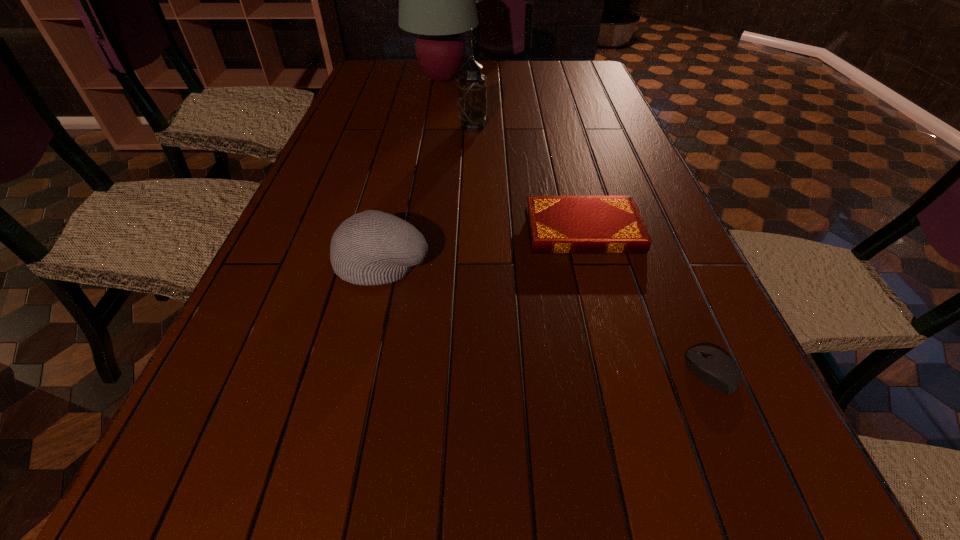
Identify the location of vacant space located 0.140m on the cover of the hardback book. (468, 230).

Locate an element on the screen. The width and height of the screenshot is (960, 540). vacant space situated 0.190m on the cover of the hardback book is located at coordinates (445, 230).

You are a GUI agent. You are given a task and a screenshot of the screen. Output one action in this format:
    pyautogui.click(x=<x>, y=<y>)
    Task: Click on the free spot located 0.150m on the cover of the hardback book
    
    Given the screenshot: What is the action you would take?
    pyautogui.click(x=463, y=230)

I want to click on vacant space located 0.090m on the back of the nearest object, so click(685, 311).

Where is `object positioned at the far edge`? object positioned at the far edge is located at coordinates (437, 0).

At what (x,y) coordinates should I click in order to perform the action: click on object located at the left edge. Please return your answer as a coordinate pair (x, y). The height and width of the screenshot is (540, 960). Looking at the image, I should click on (372, 247).

Where is `hardback book located in the right edge section of the desktop`? hardback book located in the right edge section of the desktop is located at coordinates (556, 224).

This screenshot has width=960, height=540. What are the coordinates of `computer equipment located in the right edge section of the desktop` in the screenshot? It's located at (715, 368).

In the image, there is a desktop. Where is `vacant space at the far edge`? The width and height of the screenshot is (960, 540). vacant space at the far edge is located at coordinates (493, 66).

Find the location of a particular element. This screenshot has width=960, height=540. vacant space at the left edge of the desktop is located at coordinates (299, 246).